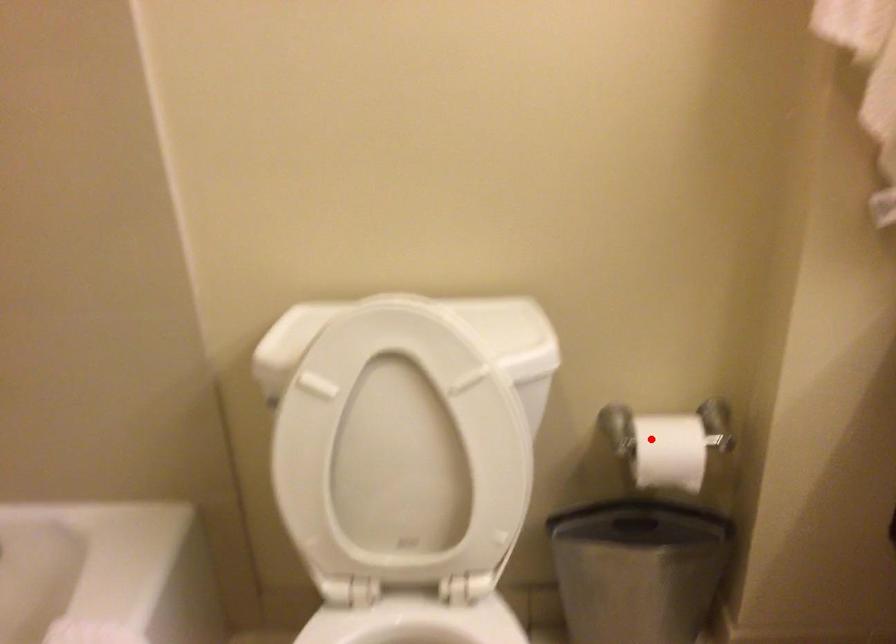
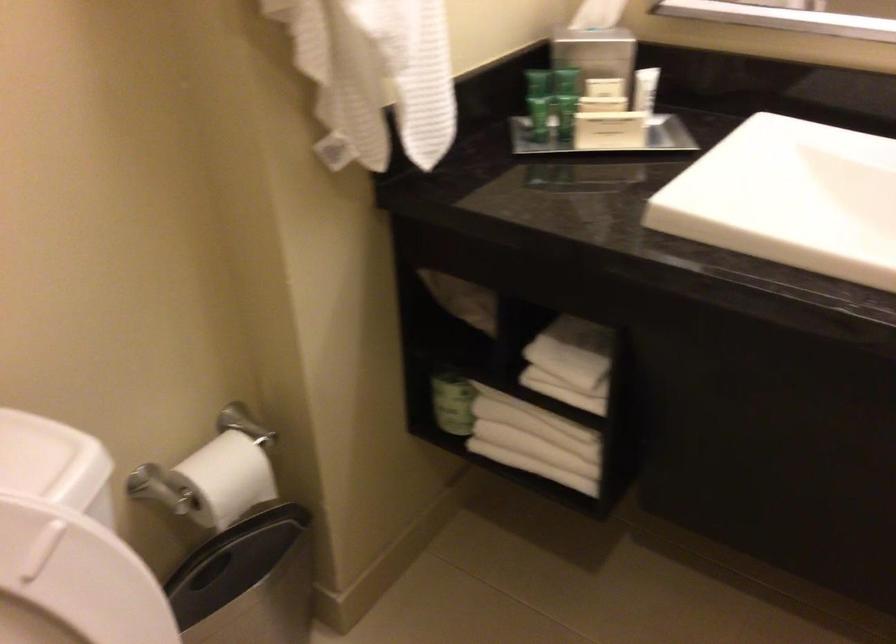
The point at the highlighted location is marked in the first image. Where is the corresponding point in the second image?

(211, 480)